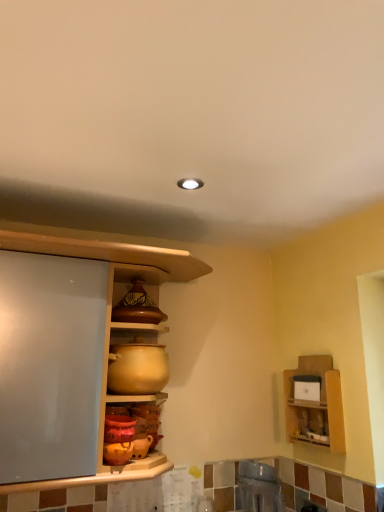
What do you see at coordinates (259, 487) in the screenshot?
I see `metallic stainless steel sink at lower center, which is the second appliance in left-to-right order` at bounding box center [259, 487].

In order to face matte wood cabinet at center, should I rotate leftwards or rightwards?

You should look left and rotate roughly 4.450 degrees.

This screenshot has width=384, height=512. Find the location of `matte wood cabinet at center`. matte wood cabinet at center is located at coordinates (73, 354).

Describe the element at coordinates (137, 369) in the screenshot. I see `matte ceramic pot at center, the second appliance ordered from the bottom` at that location.

Locate an element on the screen. The height and width of the screenshot is (512, 384). matte ceramic pot at center, which is the first appliance from top to bottom is located at coordinates (137, 369).

The image size is (384, 512). Describe the element at coordinates (130, 433) in the screenshot. I see `matte orange pot at lower center` at that location.

Where is `matte orange pot at lower center`? matte orange pot at lower center is located at coordinates (130, 433).

I want to click on wooden shelf at upper right, so click(315, 404).

Find the location of `metallic stainless steel sink at lower center, which is the second appliance in left-to-right order`. metallic stainless steel sink at lower center, which is the second appliance in left-to-right order is located at coordinates [259, 487].

I want to click on cabinet on the right of matte ceramic pot at center, placed as the 1th appliance when sorted from left to right, so click(x=137, y=295).

Is matte ceramic pot at center, the second appliance ordered from the bottom, smaller than matte brown ceramic pot at upper center?

No.

Considering the relative sizes of matte ceramic pot at center, which appears as the second appliance when viewed from the right, and matte brown ceramic pot at upper center in the image provided, is matte ceramic pot at center, which appears as the second appliance when viewed from the right, wider than matte brown ceramic pot at upper center?

Yes, matte ceramic pot at center, which appears as the second appliance when viewed from the right, is wider than matte brown ceramic pot at upper center.

Is matte wood cabinet at center to the right of matte ceramic pot at center, placed as the 1th appliance when sorted from left to right, from the viewer's perspective?

Indeed, matte wood cabinet at center is positioned on the right side of matte ceramic pot at center, placed as the 1th appliance when sorted from left to right.

Find the location of a particular element. cabinetry above the matte ceramic pot at center, placed as the 1th appliance when sorted from left to right (from a real-world perspective) is located at coordinates (73, 354).

Considering the relative sizes of matte wood cabinet at center and matte ceramic pot at center, which appears as the second appliance when viewed from the right, in the image provided, is matte wood cabinet at center taller than matte ceramic pot at center, which appears as the second appliance when viewed from the right,?

Yes, matte wood cabinet at center is taller than matte ceramic pot at center, which appears as the second appliance when viewed from the right.

From the image's perspective, is matte wood cabinet at center located above or below matte ceramic pot at center, which appears as the second appliance when viewed from the right?

matte wood cabinet at center is above matte ceramic pot at center, which appears as the second appliance when viewed from the right.

Which is more to the left, matte ceramic pot at center, placed as the 1th appliance when sorted from left to right, or matte wood cabinet at center?

matte ceramic pot at center, placed as the 1th appliance when sorted from left to right.

From the image's perspective, is matte ceramic pot at center, the second appliance ordered from the bottom, located above or below matte wood cabinet at center?

matte ceramic pot at center, the second appliance ordered from the bottom, is situated lower than matte wood cabinet at center in the image.

Identify the location of appliance that is the 1st one below the matte wood cabinet at center (from a real-world perspective). (137, 369).

Looking at this image, is matte ceramic pot at center, which appears as the second appliance when viewed from the right, taller than matte wood cabinet at center?

Incorrect, the height of matte ceramic pot at center, which appears as the second appliance when viewed from the right, is not larger of that of matte wood cabinet at center.

Based on the photo, looking at their sizes, would you say matte wood cabinet at center is wider or thinner than metallic stainless steel sink at lower center, which is the second appliance in left-to-right order?

Clearly, matte wood cabinet at center has more width compared to metallic stainless steel sink at lower center, which is the second appliance in left-to-right order.

Considering the relative positions of matte wood cabinet at center and metallic stainless steel sink at lower center, which appears as the first appliance when ordered from the bottom, in the image provided, is matte wood cabinet at center to the right of metallic stainless steel sink at lower center, which appears as the first appliance when ordered from the bottom, from the viewer's perspective?

Incorrect, matte wood cabinet at center is not on the right side of metallic stainless steel sink at lower center, which appears as the first appliance when ordered from the bottom.

Which of these two, matte wood cabinet at center or metallic stainless steel sink at lower center, which appears as the first appliance when ordered from the bottom, is bigger?

With larger size is matte wood cabinet at center.

Is matte wood cabinet at center not within metallic stainless steel sink at lower center, which appears as the first appliance when ordered from the bottom?

That's correct, matte wood cabinet at center is outside of metallic stainless steel sink at lower center, which appears as the first appliance when ordered from the bottom.

Based on the photo, would you say matte brown ceramic pot at upper center is to the left or to the right of wooden shelf at upper right in the picture?

In the image, matte brown ceramic pot at upper center appears on the left side of wooden shelf at upper right.

Is wooden shelf at upper right located within matte brown ceramic pot at upper center?

No, wooden shelf at upper right is not inside matte brown ceramic pot at upper center.

Find the location of `shelf below the matte brown ceramic pot at upper center (from the image's perspective)`. shelf below the matte brown ceramic pot at upper center (from the image's perspective) is located at coordinates (315, 404).

Is wooden shelf at upper right not close to matte ceramic pot at center, which is the first appliance from top to bottom?

wooden shelf at upper right is actually quite close to matte ceramic pot at center, which is the first appliance from top to bottom.

Can we say wooden shelf at upper right lies outside matte ceramic pot at center, the second appliance ordered from the bottom?

That's correct, wooden shelf at upper right is outside of matte ceramic pot at center, the second appliance ordered from the bottom.

From a real-world perspective, who is located lower, wooden shelf at upper right or matte ceramic pot at center, which is the first appliance from top to bottom?

In real-world perspective, wooden shelf at upper right is lower.

From a real-world perspective, is matte ceramic pot at center, which appears as the second appliance when viewed from the right, located beneath metallic stainless steel sink at lower center, placed as the 1th appliance when sorted from right to left?

Incorrect, from a real-world perspective, matte ceramic pot at center, which appears as the second appliance when viewed from the right, is higher than metallic stainless steel sink at lower center, placed as the 1th appliance when sorted from right to left.

Between point (150, 354) and point (263, 482), which one is positioned behind?

The point (263, 482) is more distant.

Does matte ceramic pot at center, the second appliance ordered from the bottom, have a smaller size compared to metallic stainless steel sink at lower center, placed as the 1th appliance when sorted from right to left?

No.

Which of these two, matte ceramic pot at center, placed as the 1th appliance when sorted from left to right, or metallic stainless steel sink at lower center, which appears as the first appliance when ordered from the bottom, is thinner?

metallic stainless steel sink at lower center, which appears as the first appliance when ordered from the bottom, is thinner.

From the image's perspective, starting from the matte brown ceramic pot at upper center, which appliance is the 1st one below? Please provide its 2D coordinates.

[(137, 369)]

This screenshot has width=384, height=512. Identify the location of cabinetry that appears above the matte ceramic pot at center, which is the first appliance from top to bottom (from a real-world perspective). (73, 354).

Looking at the image, which one is located further to matte ceramic pot at center, which is the first appliance from top to bottom, matte orange pot at lower center or metallic stainless steel sink at lower center, placed as the 1th appliance when sorted from right to left?

metallic stainless steel sink at lower center, placed as the 1th appliance when sorted from right to left, is further to matte ceramic pot at center, which is the first appliance from top to bottom.

Considering their positions, is matte orange pot at lower center positioned closer to metallic stainless steel sink at lower center, placed as the 1th appliance when sorted from right to left, than wooden shelf at upper right?

wooden shelf at upper right is positioned closer to the anchor metallic stainless steel sink at lower center, placed as the 1th appliance when sorted from right to left.

Considering their positions, is matte ceramic pot at center, which is the first appliance from top to bottom, positioned further to matte orange pot at lower center than wooden shelf at upper right?

wooden shelf at upper right is further to matte orange pot at lower center.

Considering their positions, is matte orange pot at lower center positioned further to matte brown ceramic pot at upper center than metallic stainless steel sink at lower center, placed as the 1th appliance when sorted from right to left?

The object further to matte brown ceramic pot at upper center is metallic stainless steel sink at lower center, placed as the 1th appliance when sorted from right to left.

Based on the photo, from the image, which object appears to be farther from wooden shelf at upper right, matte ceramic pot at center, placed as the 1th appliance when sorted from left to right, or metallic stainless steel sink at lower center, the second appliance viewed from the top?

matte ceramic pot at center, placed as the 1th appliance when sorted from left to right, is further to wooden shelf at upper right.

From the image, which object appears to be nearer to metallic stainless steel sink at lower center, placed as the 1th appliance when sorted from right to left, matte wood cabinet at center or matte brown ceramic pot at upper center?

matte wood cabinet at center lies closer to metallic stainless steel sink at lower center, placed as the 1th appliance when sorted from right to left, than the other object.

From the image, which object appears to be farther from wooden shelf at upper right, matte orange pot at lower center or matte wood cabinet at center?

matte wood cabinet at center is positioned further to the anchor wooden shelf at upper right.

Estimate the real-world distances between objects in this image. Which object is further from matte brown ceramic pot at upper center, matte ceramic pot at center, which is the first appliance from top to bottom, or metallic stainless steel sink at lower center, which appears as the first appliance when ordered from the bottom?

Among the two, metallic stainless steel sink at lower center, which appears as the first appliance when ordered from the bottom, is located further to matte brown ceramic pot at upper center.

In order to click on appliance between matte wood cabinet at center and wooden shelf at upper right in the horizontal direction in this screenshot , I will do `click(259, 487)`.

I want to click on appliance between matte brown ceramic pot at upper center and matte orange pot at lower center from top to bottom, so [x=137, y=369].

I want to click on cabinetry between matte brown ceramic pot at upper center and wooden shelf at upper right, so click(x=73, y=354).

Find the location of a particular element. pottery between matte brown ceramic pot at upper center and metallic stainless steel sink at lower center, which appears as the first appliance when ordered from the bottom, vertically is located at coordinates (130, 433).